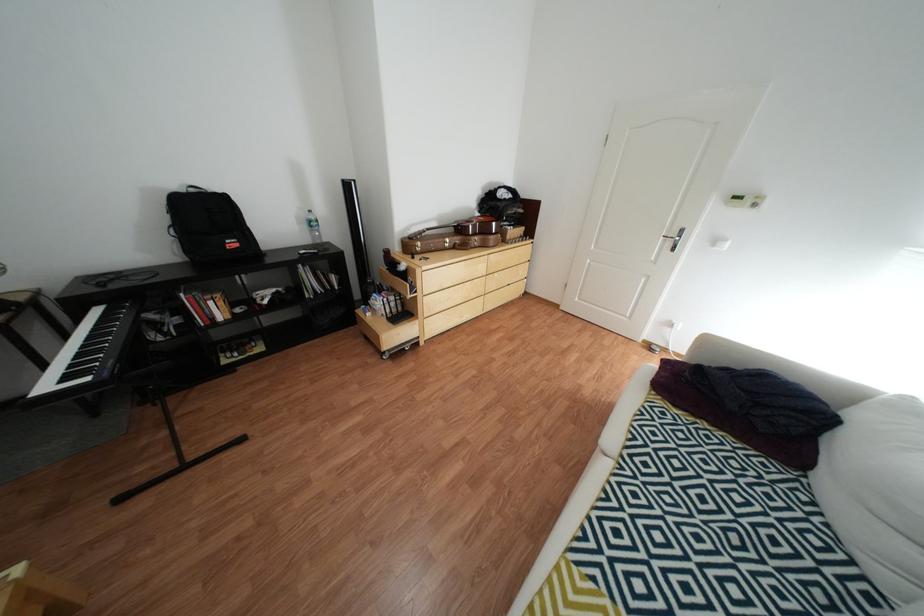
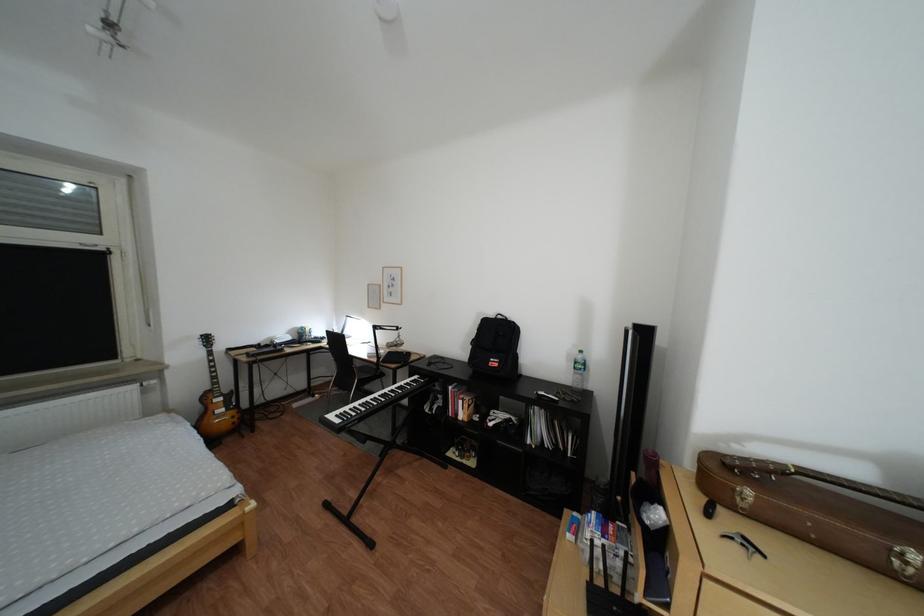
In the second image, find the point that corresponds to [456,241] in the first image.

(885, 537)